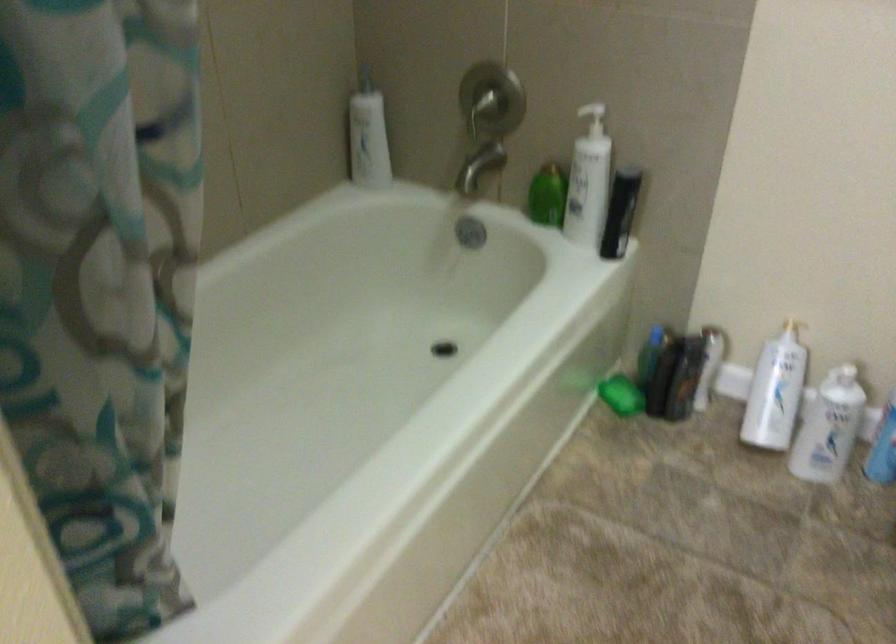
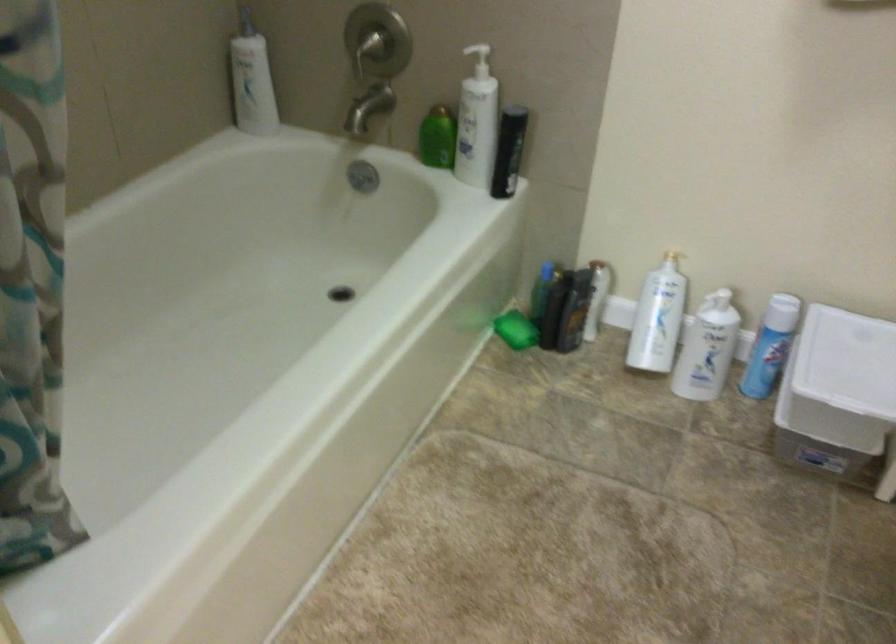
Where in the second image is the point corresponding to [661,377] from the first image?

(554, 308)